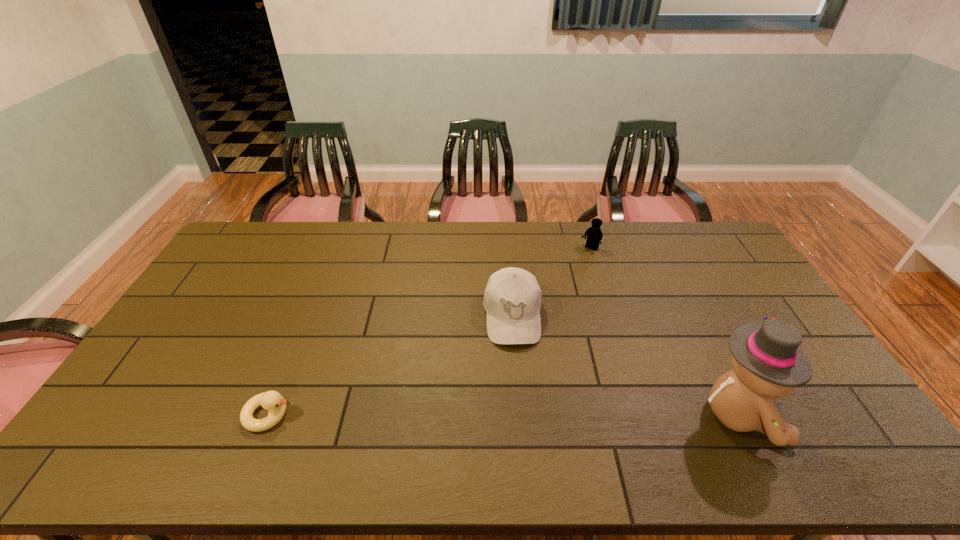
In the image, there is a desktop. Identify the location of vacant space at the near edge. (708, 411).

At what (x,y) coordinates should I click in order to perform the action: click on blank space at the left edge. Please return your answer as a coordinate pair (x, y). This screenshot has width=960, height=540. Looking at the image, I should click on (183, 355).

Identify the location of vacant space at the right edge. (756, 305).

I want to click on vacant area between the rightmost object and the Lego, so tap(665, 332).

At what (x,y) coordinates should I click in order to perform the action: click on vacant area that lies between the Lego and the shortest object. Please return your answer as a coordinate pair (x, y). Looking at the image, I should click on (429, 332).

Locate an element on the screen. Image resolution: width=960 pixels, height=540 pixels. vacant space that's between the Lego and the shortest object is located at coordinates (429, 332).

Where is `vacant space that is in between the Lego and the rag_doll`? The height and width of the screenshot is (540, 960). vacant space that is in between the Lego and the rag_doll is located at coordinates (665, 332).

The height and width of the screenshot is (540, 960). What are the coordinates of `free spot between the duckling and the third object from left to right` in the screenshot? It's located at (429, 332).

The image size is (960, 540). What are the coordinates of `free spot between the second farthest object and the shortest object` in the screenshot? It's located at (391, 365).

This screenshot has height=540, width=960. Identify the location of vacant space that is in between the second object from left to right and the Lego. (551, 282).